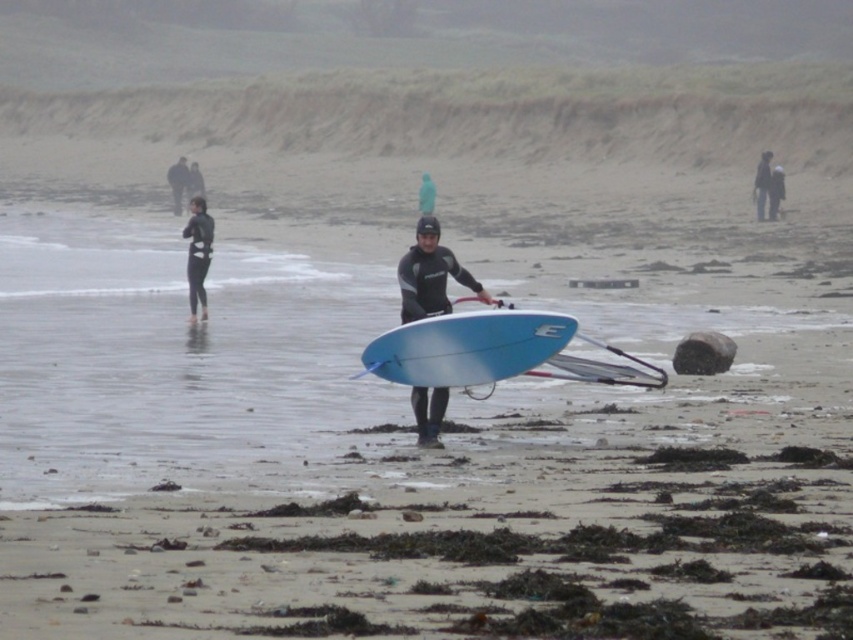
Question: Is blue matte surfboard at center to the left of black wetsuit at left from the viewer's perspective?

Choices:
 (A) yes
 (B) no

Answer: (B)

Question: Which of the following is the farthest from the observer?

Choices:
 (A) blue matte surfboard at center
 (B) matte black wetsuit at center
 (C) black wetsuit at left

Answer: (C)

Question: Is blue matte surfboard at center to the right of matte black wetsuit at center from the viewer's perspective?

Choices:
 (A) yes
 (B) no

Answer: (A)

Question: Which point is closer to the camera?

Choices:
 (A) black wetsuit at left
 (B) blue matte surfboard at center

Answer: (B)

Question: Which point is farther to the camera?

Choices:
 (A) blue matte surfboard at center
 (B) matte black wetsuit at center
 (C) black wetsuit at left

Answer: (C)

Question: Does matte black wetsuit at center appear on the left side of black wetsuit at left?

Choices:
 (A) no
 (B) yes

Answer: (A)